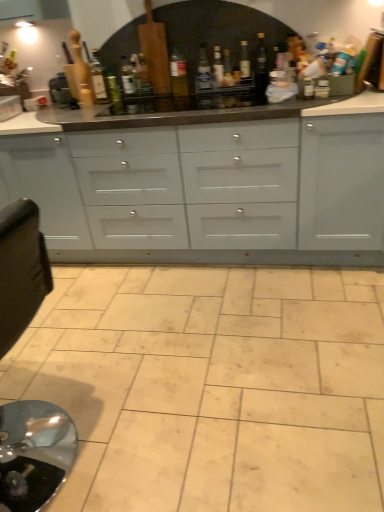
The width and height of the screenshot is (384, 512). What are the coordinates of `vacant space situated on the left part of black glass bottle at center, which appears as the 1th bottle when viewed from the right` in the screenshot? It's located at (239, 92).